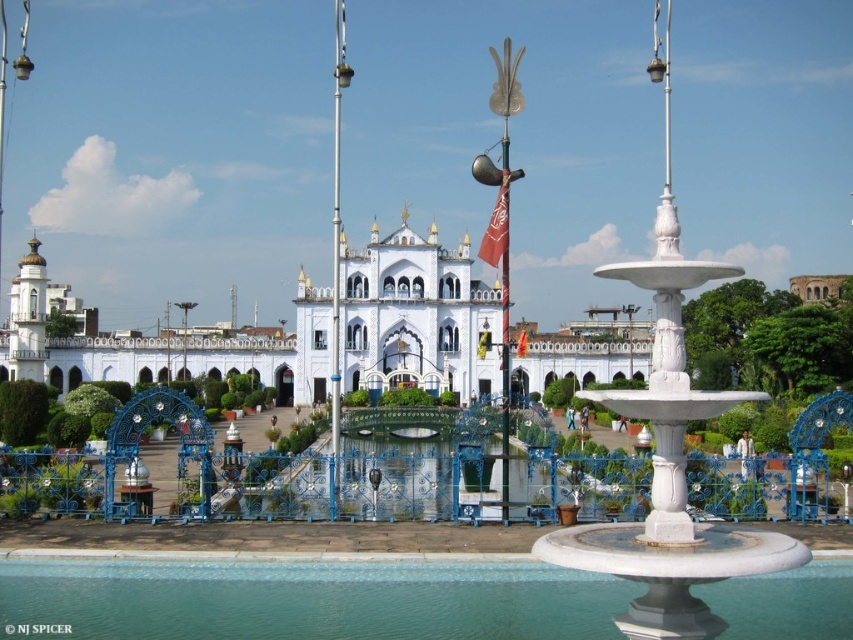
You are standing in front of the grand architectural structure. You see the white marble palace at center and the white marble fountain at center. Which one is positioned to the left side?

The white marble palace at center is positioned to the left of the white marble fountain at center.

In the scene shown: You are standing in front of the grand temple or palace with intricate arches and domes. You notice two specific points marked on the structure. The first point is at coordinates point (380, 388) and the second is at point (668, 1). From your vantage point, which of these two points is closer to you?

Point (380, 388) is in front of point (668, 1), so it is closer to you.

You are standing at the entrance of the temple and want to reach the clear glass pool at center. There is a white marble fountain at center blocking your path. Can you walk around the fountain to get to the pool?

The clear glass pool at center is 23.48 meters away from the white marble fountain at center, so yes, you can walk around the fountain to reach the pool since there is enough space between them.